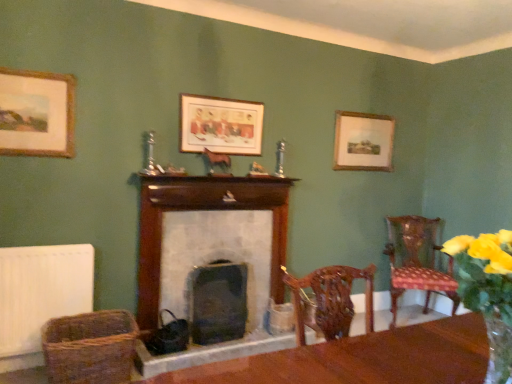
Question: From the image's perspective, is black stone fireplace at center, which is the 1th fireplace in bottom-to-top order, located above or below yellow fabric flower at right?

Choices:
 (A) below
 (B) above

Answer: (A)

Question: Considering the positions of point (222, 291) and point (488, 311), is point (222, 291) closer or farther from the camera than point (488, 311)?

Choices:
 (A) closer
 (B) farther

Answer: (B)

Question: Based on their relative distances, which object is nearer to the white matte radiator at lower left?

Choices:
 (A) black stone fireplace at center, placed as the 2th fireplace when sorted from top to bottom
 (B) wooden picture frame at upper right, the third picture frame positioned from the front
 (C) polka dot fabric chair at right
 (D) wooden picture frame at upper left, the 1th picture frame from the left
 (E) yellow fabric flower at right

Answer: (D)

Question: Estimate the real-world distances between objects in this image. Which object is farther from the wooden picture frame at upper left, positioned as the third picture frame in back-to-front order?

Choices:
 (A) woven brown basket at lower left
 (B) yellow fabric flower at right
 (C) wooden picture frame at upper right, the third picture frame positioned from the front
 (D) polka dot fabric chair at right
 (E) white matte radiator at lower left

Answer: (D)